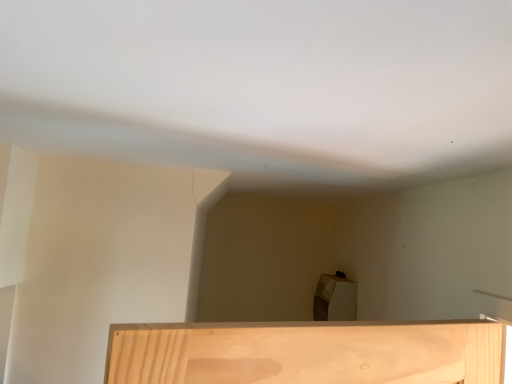
The width and height of the screenshot is (512, 384). What do you see at coordinates (335, 299) in the screenshot?
I see `matte brown wood at center` at bounding box center [335, 299].

Find the location of a particular element. matte brown wood at center is located at coordinates (335, 299).

Find the location of `matte brown wood at center`. matte brown wood at center is located at coordinates [x=335, y=299].